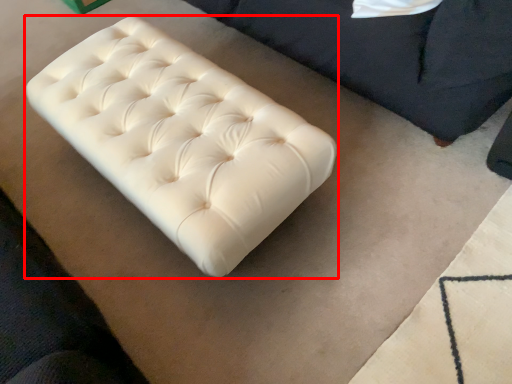
Question: From the image's perspective, where is furniture (annotated by the red box) located relative to furniture?

Choices:
 (A) above
 (B) below

Answer: (B)